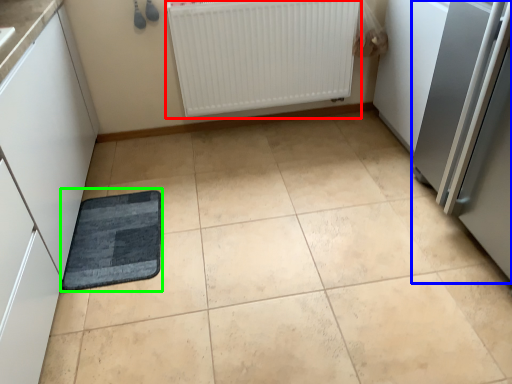
Question: Which object is the closest to the radiator (highlighted by a red box)? Choose among these: appliance (highlighted by a blue box) or mat (highlighted by a green box).

Choices:
 (A) appliance
 (B) mat

Answer: (A)